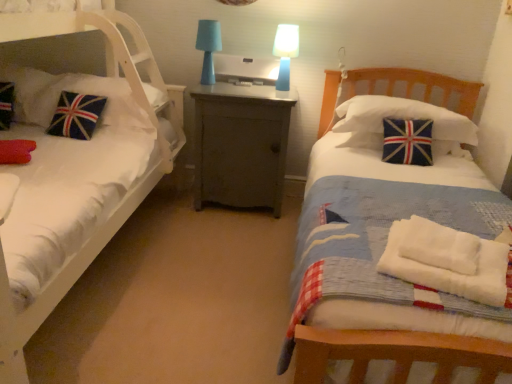
Where is `free spot in front of matte gray cabinet at center`? free spot in front of matte gray cabinet at center is located at coordinates (225, 237).